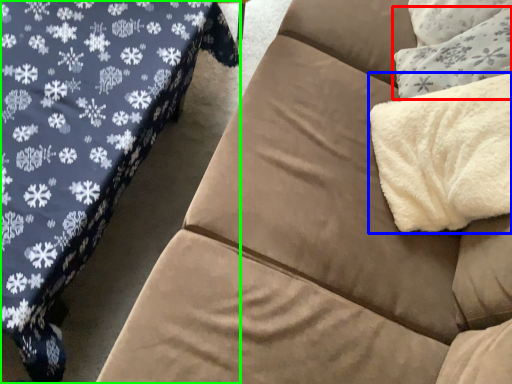
Question: Based on their relative distances, which object is nearer to throw pillow (highlighted by a red box)? Choose from blanket (highlighted by a blue box) and studio couch (highlighted by a green box).

Choices:
 (A) blanket
 (B) studio couch

Answer: (A)